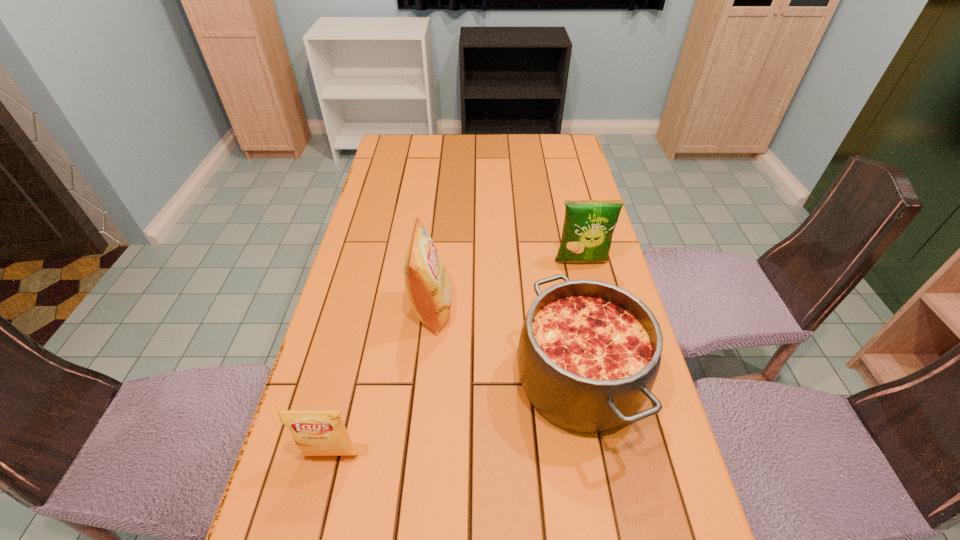
Image resolution: width=960 pixels, height=540 pixels. Identify the location of vacant area that lies between the nearest crisp (potato chip) and the casserole. (455, 418).

Where is `free spot between the second crisp (potato chip) from left to right and the shortest crisp (potato chip)`? Image resolution: width=960 pixels, height=540 pixels. free spot between the second crisp (potato chip) from left to right and the shortest crisp (potato chip) is located at coordinates (382, 382).

Where is `vacant area that lies between the farthest crisp (potato chip) and the second crisp (potato chip) from left to right`? The image size is (960, 540). vacant area that lies between the farthest crisp (potato chip) and the second crisp (potato chip) from left to right is located at coordinates (507, 286).

Where is `vacant point located between the shortest crisp (potato chip) and the casserole`? This screenshot has height=540, width=960. vacant point located between the shortest crisp (potato chip) and the casserole is located at coordinates (455, 418).

Where is `the closest object to the second nearest crisp (potato chip)`? the closest object to the second nearest crisp (potato chip) is located at coordinates (589, 352).

Choose which object is the third nearest neighbor to the casserole. Please provide its 2D coordinates. Your answer should be formatted as a tuple, i.e. [(x, y)], where the tuple contains the x and y coordinates of a point satisfying the conditions above.

[(316, 432)]

You are a GUI agent. You are given a task and a screenshot of the screen. Output one action in this format:
    pyautogui.click(x=<x>, y=<y>)
    Task: Click on the crisp (potato chip) that is the second closest to the casserole
    Image resolution: width=960 pixels, height=540 pixels.
    Given the screenshot: What is the action you would take?
    (x=588, y=227)

Select which crisp (potato chip) is the closest to the leftmost object. Please provide its 2D coordinates. Your answer should be formatted as a tuple, i.e. [(x, y)], where the tuple contains the x and y coordinates of a point satisfying the conditions above.

[(429, 287)]

You are a GUI agent. You are given a task and a screenshot of the screen. Output one action in this format:
    pyautogui.click(x=<x>, y=<y>)
    Task: Click on the vacant space that satisfies the following two spatial constraints: 1. on the front-facing side of the rightmost crisp (potato chip); 2. on the front-facing side of the second farthest crisp (potato chip)
    The height and width of the screenshot is (540, 960).
    Given the screenshot: What is the action you would take?
    pyautogui.click(x=592, y=309)

Locate an element on the screen. free space that satisfies the following two spatial constraints: 1. on the front-facing side of the rightmost crisp (potato chip); 2. on the front-facing side of the second nearest crisp (potato chip) is located at coordinates (592, 309).